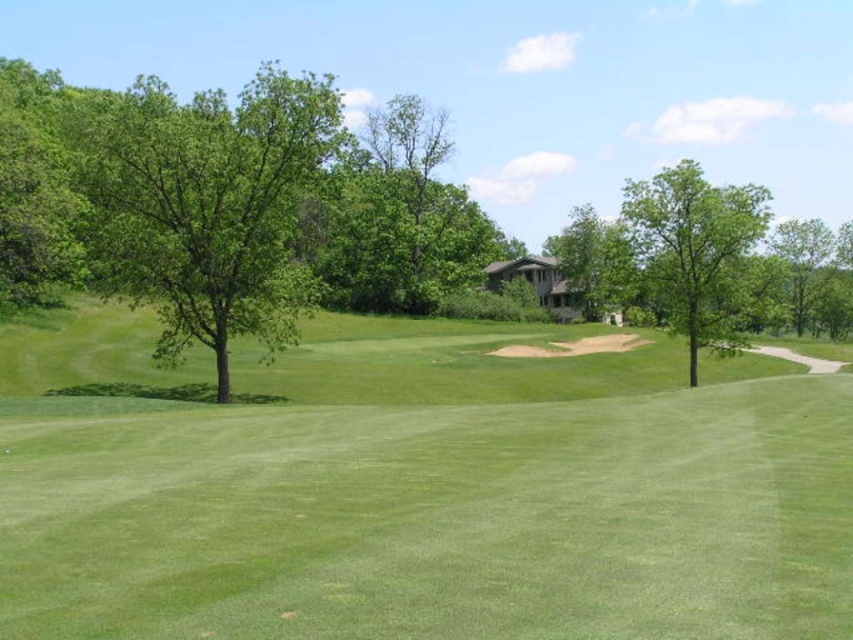
Locate an element on the screen. This screenshot has height=640, width=853. green leafy tree at center is located at coordinates (399, 218).

Does green leafy tree at center appear over green leafy tree at upper right?

Indeed, green leafy tree at center is positioned over green leafy tree at upper right.

Which is behind, point (427, 161) or point (830, 292)?

Point (830, 292)

Where is `green leafy tree at center`? This screenshot has width=853, height=640. green leafy tree at center is located at coordinates (399, 218).

Who is more forward, (x=265, y=301) or (x=397, y=140)?

Positioned in front is point (x=265, y=301).

Consider the image. Does green leafy tree at left lie in front of green leafy tree at center?

Yes.

Which is behind, point (292, 120) or point (462, 252)?

The point (462, 252) is more distant.

Locate an element on the screen. green leafy tree at left is located at coordinates (207, 205).

Between green leafy tree at center and green leafy tree at right, which one has more height?

Standing taller between the two is green leafy tree at center.

What do you see at coordinates (399, 218) in the screenshot? I see `green leafy tree at center` at bounding box center [399, 218].

Locate an element on the screen. green leafy tree at center is located at coordinates point(399,218).